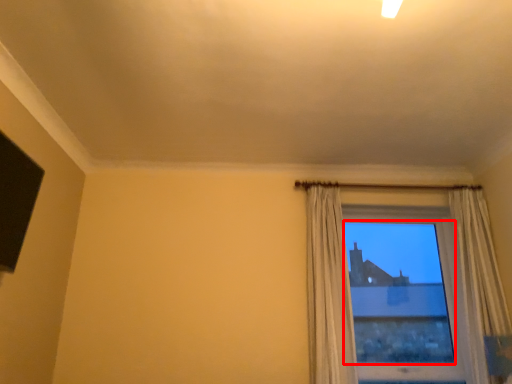
Question: From the image's perspective, considering the relative positions of window screen (annotated by the red box) and curtain in the image provided, where is window screen (annotated by the red box) located with respect to the staircase?

Choices:
 (A) above
 (B) below

Answer: (B)